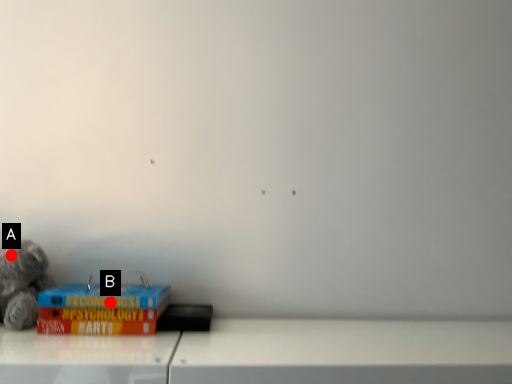
Question: Two points are circled on the image, labeled by A and B beside each circle. Which point appears closest to the camera in this image?

Choices:
 (A) A is closer
 (B) B is closer

Answer: (B)